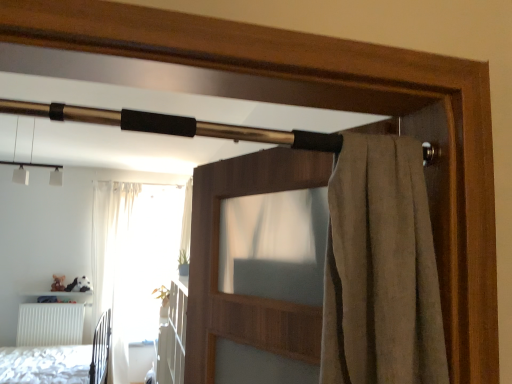
The width and height of the screenshot is (512, 384). Describe the element at coordinates (56, 352) in the screenshot. I see `white textured bed at lower left` at that location.

Image resolution: width=512 pixels, height=384 pixels. What do you see at coordinates (50, 324) in the screenshot?
I see `white matte radiator at lower left` at bounding box center [50, 324].

In order to click on white matte radiator at lower left in this screenshot , I will do `click(50, 324)`.

This screenshot has width=512, height=384. I want to click on white sheer curtain at left, so click(x=113, y=266).

Is white sheer curtain at left in front of or behind white textured bed at lower left in the image?

Clearly, white sheer curtain at left is behind white textured bed at lower left.

From a real-world perspective, is white sheer curtain at left located beneath white textured bed at lower left?

No, from a real-world perspective, white sheer curtain at left is not beneath white textured bed at lower left.

Which of these two, white sheer curtain at left or white textured bed at lower left, is smaller?

Smaller between the two is white sheer curtain at left.

What are the coordinates of `curtain behind the white textured bed at lower left` in the screenshot? It's located at (113, 266).

Can you confirm if white matte radiator at lower left is wider than white sheer curtain at left?

No.

Is the position of white matte radiator at lower left more distant than that of white sheer curtain at left?

No, white matte radiator at lower left is closer to the camera.

Find the location of `curtain above the white matte radiator at lower left (from a real-world perspective)`. curtain above the white matte radiator at lower left (from a real-world perspective) is located at coordinates (113, 266).

From the picture: Can you tell me how much white matte radiator at lower left and white sheer curtain at left differ in facing direction?

4.26 degrees.

Does brown fabric screen door at upper center touch white sheer curtain at left?

No, brown fabric screen door at upper center is not in contact with white sheer curtain at left.

Is brown fabric screen door at upper center bigger than white sheer curtain at left?

No, brown fabric screen door at upper center is not bigger than white sheer curtain at left.

Would you say brown fabric screen door at upper center is inside or outside white sheer curtain at left?

brown fabric screen door at upper center cannot be found inside white sheer curtain at left.

Looking at this image, relative to brown fabric screen door at upper center, is white matte radiator at lower left in front or behind?

Clearly, white matte radiator at lower left is behind brown fabric screen door at upper center.

Considering the relative positions of white matte radiator at lower left and brown fabric screen door at upper center in the image provided, is white matte radiator at lower left to the left or to the right of brown fabric screen door at upper center?

Clearly, white matte radiator at lower left is on the left of brown fabric screen door at upper center in the image.

From a real-world perspective, relative to brown fabric screen door at upper center, is white matte radiator at lower left vertically above or below?

From a real-world perspective, white matte radiator at lower left is physically below brown fabric screen door at upper center.

Is white textured bed at lower left closer to camera compared to brown fabric screen door at upper center?

No, the depth of white textured bed at lower left is greater than that of brown fabric screen door at upper center.

Is white textured bed at lower left taller than brown fabric screen door at upper center?

Yes.

From a real-world perspective, is white textured bed at lower left beneath brown fabric screen door at upper center?

Yes, from a real-world perspective, white textured bed at lower left is under brown fabric screen door at upper center.

Between white textured bed at lower left and brown fabric screen door at upper center, which one has larger size?

Bigger between the two is white textured bed at lower left.

Based on their sizes in the image, would you say white matte radiator at lower left is bigger or smaller than white textured bed at lower left?

Clearly, white matte radiator at lower left is smaller in size than white textured bed at lower left.

From a real-world perspective, is white matte radiator at lower left located beneath white textured bed at lower left?

No, from a real-world perspective, white matte radiator at lower left is not below white textured bed at lower left.

What are the coordinates of `radiator behind the white textured bed at lower left` in the screenshot? It's located at (50, 324).

In terms of width, does white sheer curtain at left look wider or thinner when compared to white matte radiator at lower left?

Considering their sizes, white sheer curtain at left looks broader than white matte radiator at lower left.

From the image's perspective, between white sheer curtain at left and white matte radiator at lower left, which one is located above?

From the image's view, white sheer curtain at left is above.

Is white sheer curtain at left not close to white matte radiator at lower left?

No.

Is white sheer curtain at left oriented away from white matte radiator at lower left?

No, white sheer curtain at left is not facing away from white matte radiator at lower left.

In order to click on bed below the white sheer curtain at left (from a real-world perspective) in this screenshot , I will do `click(56, 352)`.

Identify the location of curtain on the right of white matte radiator at lower left. The height and width of the screenshot is (384, 512). (x=113, y=266).

Estimate the real-world distances between objects in this image. Which object is closer to white sheer curtain at left, white textured bed at lower left or brown fabric screen door at upper center?

Based on the image, white textured bed at lower left appears to be nearer to white sheer curtain at left.

Looking at the image, which one is located further to white textured bed at lower left, white matte radiator at lower left or white sheer curtain at left?

white matte radiator at lower left lies further to white textured bed at lower left than the other object.

Estimate the real-world distances between objects in this image. Which object is further from brown fabric screen door at upper center, white matte radiator at lower left or white sheer curtain at left?

white matte radiator at lower left.

Looking at the image, which one is located further to white sheer curtain at left, white matte radiator at lower left or brown fabric screen door at upper center?

brown fabric screen door at upper center is positioned further to the anchor white sheer curtain at left.

From the image, which object appears to be farther from white textured bed at lower left, white matte radiator at lower left or brown fabric screen door at upper center?

The object further to white textured bed at lower left is brown fabric screen door at upper center.

Estimate the real-world distances between objects in this image. Which object is closer to white matte radiator at lower left, white sheer curtain at left or brown fabric screen door at upper center?

Based on the image, white sheer curtain at left appears to be nearer to white matte radiator at lower left.

From the picture: Considering their positions, is white textured bed at lower left positioned closer to white matte radiator at lower left than brown fabric screen door at upper center?

white textured bed at lower left lies closer to white matte radiator at lower left than the other object.

Estimate the real-world distances between objects in this image. Which object is closer to brown fabric screen door at upper center, white textured bed at lower left or white sheer curtain at left?

white textured bed at lower left.

The height and width of the screenshot is (384, 512). Identify the location of bed between brown fabric screen door at upper center and white matte radiator at lower left from front to back. (56, 352).

Where is `bed positioned between brown fabric screen door at upper center and white sheer curtain at left from near to far`? Image resolution: width=512 pixels, height=384 pixels. bed positioned between brown fabric screen door at upper center and white sheer curtain at left from near to far is located at coordinates [x=56, y=352].

The height and width of the screenshot is (384, 512). What are the coordinates of `radiator between white textured bed at lower left and white sheer curtain at left from front to back` in the screenshot? It's located at (50, 324).

Identify the location of radiator between brown fabric screen door at upper center and white sheer curtain at left in the front-back direction. The image size is (512, 384). (50, 324).